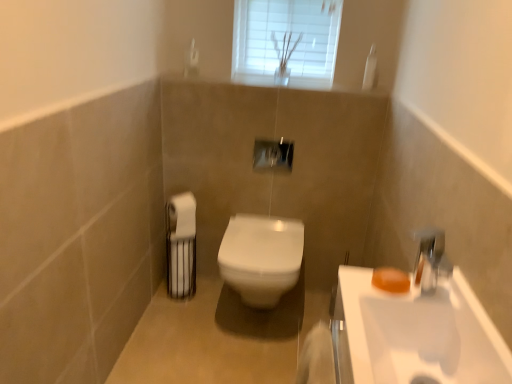
Describe the element at coordinates (431, 259) in the screenshot. I see `chrome metallic faucet at upper right` at that location.

I want to click on white glass window at upper center, so click(x=286, y=41).

Can white glossy toilet at center be found inside white glossy sink at lower right?

Actually, white glossy toilet at center is outside white glossy sink at lower right.

In the image, there is a white glossy sink at lower right. Where is `toilet above it (from the image's perspective)`? The width and height of the screenshot is (512, 384). toilet above it (from the image's perspective) is located at coordinates (261, 257).

Based on the photo, is white glossy sink at lower right in front of or behind white glossy toilet at center in the image?

white glossy sink at lower right is positioned closer to the viewer than white glossy toilet at center.

From the image's perspective, which is below, white glossy sink at lower right or white glossy toilet at center?

white glossy sink at lower right appears lower in the image.

From the image's perspective, between white matte toilet paper at left and chrome metallic faucet at upper right, which one is located above?

white matte toilet paper at left.

Would you say chrome metallic faucet at upper right is part of white matte toilet paper at left's contents?

That's incorrect, chrome metallic faucet at upper right is not inside white matte toilet paper at left.

Considering the positions of point (190, 214) and point (434, 285), is point (190, 214) closer or farther from the camera than point (434, 285)?

Point (190, 214) is farther from the camera than point (434, 285).

Considering the sizes of objects white matte toilet paper at left and chrome metallic faucet at upper right in the image provided, who is wider, white matte toilet paper at left or chrome metallic faucet at upper right?

Wider between the two is white matte toilet paper at left.

The image size is (512, 384). In order to click on sink in front of the chrome metallic faucet at upper right in this screenshot , I will do `click(419, 333)`.

Can you confirm if white glossy sink at lower right is wider than chrome metallic faucet at upper right?

Yes, white glossy sink at lower right is wider than chrome metallic faucet at upper right.

Based on their positions, is white glossy sink at lower right located to the left or right of chrome metallic faucet at upper right?

white glossy sink at lower right is to the left of chrome metallic faucet at upper right.

Choose the correct answer: Is white glossy sink at lower right inside chrome metallic faucet at upper right or outside it?

white glossy sink at lower right exists outside the volume of chrome metallic faucet at upper right.

Is white glass window at upper center wider than white glossy toilet at center?

In fact, white glass window at upper center might be narrower than white glossy toilet at center.

Is white glass window at upper center not within white glossy toilet at center?

Indeed, white glass window at upper center is completely outside white glossy toilet at center.

Between white glass window at upper center and white glossy toilet at center, which one is positioned behind?

white glass window at upper center.

Which is in front, point (261, 72) or point (256, 241)?

Point (256, 241)

Is white glass window at upper center thinner than white matte toilet paper at left?

In fact, white glass window at upper center might be wider than white matte toilet paper at left.

From a real-world perspective, is white glass window at upper center under white matte toilet paper at left?

No.

How far apart are white glass window at upper center and white matte toilet paper at left?

A distance of 37.90 inches exists between white glass window at upper center and white matte toilet paper at left.

Would you say white glass window at upper center is outside white matte toilet paper at left?

Yes, white glass window at upper center is outside of white matte toilet paper at left.

From the image's perspective, relative to white glossy toilet at center, is orange matte soap at right above or below?

orange matte soap at right is situated higher than white glossy toilet at center in the image.

In the image, is orange matte soap at right positioned in front of or behind white glossy toilet at center?

orange matte soap at right is in front of white glossy toilet at center.

Is orange matte soap at right facing away from white glossy toilet at center?

No, orange matte soap at right is not facing away from white glossy toilet at center.

Looking at this image, considering the positions of objects orange matte soap at right and white glossy toilet at center in the image provided, who is more to the left, orange matte soap at right or white glossy toilet at center?

From the viewer's perspective, white glossy toilet at center appears more on the left side.

From a real-world perspective, which object rests below the other?

In real-world perspective, white glossy toilet at center is lower.

Do you think white glossy toilet at center is within white glossy sink at lower right, or outside of it?

white glossy toilet at center cannot be found inside white glossy sink at lower right.

From the image's perspective, is white glossy toilet at center on top of white glossy sink at lower right?

Correct, white glossy toilet at center appears higher than white glossy sink at lower right in the image.

Considering the positions of objects white glossy toilet at center and white glossy sink at lower right in the image provided, who is more to the right, white glossy toilet at center or white glossy sink at lower right?

Positioned to the right is white glossy sink at lower right.

This screenshot has height=384, width=512. In the image, there is a white glossy sink at lower right. What are the coordinates of `toilet below it (from a real-world perspective)` in the screenshot? It's located at (261, 257).

The image size is (512, 384). I want to click on plumbing fixture below the white matte toilet paper at left (from the image's perspective), so click(x=431, y=259).

When comparing their distances from white glass window at upper center, does white matte toilet paper at left or chrome metallic faucet at upper right seem further?

The object further to white glass window at upper center is chrome metallic faucet at upper right.

Considering their positions, is orange matte soap at right positioned further to white matte toilet paper at left than white glossy toilet at center?

orange matte soap at right.

Estimate the real-world distances between objects in this image. Which object is closer to white glossy toilet at center, white matte toilet paper at left or white glass window at upper center?

Among the two, white matte toilet paper at left is located nearer to white glossy toilet at center.

When comparing their distances from chrome metallic faucet at upper right, does white matte toilet paper at left or orange matte soap at right seem closer?

The object closer to chrome metallic faucet at upper right is orange matte soap at right.

Considering their positions, is white glass window at upper center positioned closer to chrome metallic faucet at upper right than white glossy sink at lower right?

Based on the image, white glossy sink at lower right appears to be nearer to chrome metallic faucet at upper right.

Based on their spatial positions, is orange matte soap at right or white glossy toilet at center closer to white glass window at upper center?

white glossy toilet at center is closer to white glass window at upper center.

When comparing their distances from white glossy toilet at center, does white matte toilet paper at left or white glossy sink at lower right seem further?

The object further to white glossy toilet at center is white glossy sink at lower right.

Estimate the real-world distances between objects in this image. Which object is closer to white glossy sink at lower right, white glass window at upper center or white glossy toilet at center?

white glossy toilet at center is closer to white glossy sink at lower right.

The image size is (512, 384). Find the location of `plumbing fixture positioned between white glossy sink at lower right and white glossy toilet at center from near to far`. plumbing fixture positioned between white glossy sink at lower right and white glossy toilet at center from near to far is located at coordinates (431, 259).

Where is `toilet paper that lies between white glass window at upper center and white glossy toilet at center from top to bottom`? This screenshot has height=384, width=512. toilet paper that lies between white glass window at upper center and white glossy toilet at center from top to bottom is located at coordinates (182, 215).

What are the coordinates of `soap located between white glossy sink at lower right and white glossy toilet at center in the depth direction` in the screenshot? It's located at (391, 280).

At what (x,y) coordinates should I click in order to perform the action: click on soap between chrome metallic faucet at upper right and white matte toilet paper at left along the z-axis. Please return your answer as a coordinate pair (x, y). The width and height of the screenshot is (512, 384). Looking at the image, I should click on (391, 280).